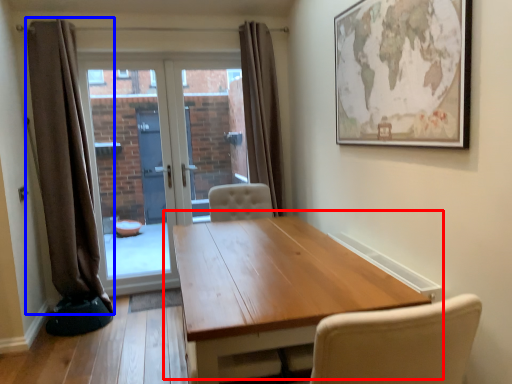
Question: Which point is further to the camera, table (highlighted by a red box) or curtain (highlighted by a blue box)?

Choices:
 (A) table
 (B) curtain

Answer: (B)